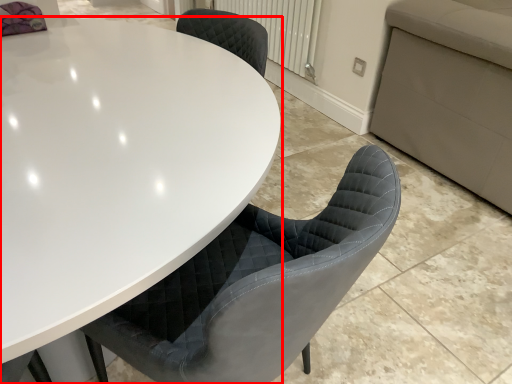
Question: Considering the relative positions of table (annotated by the red box) and radiator in the image provided, where is table (annotated by the red box) located with respect to the staircase?

Choices:
 (A) right
 (B) left

Answer: (B)